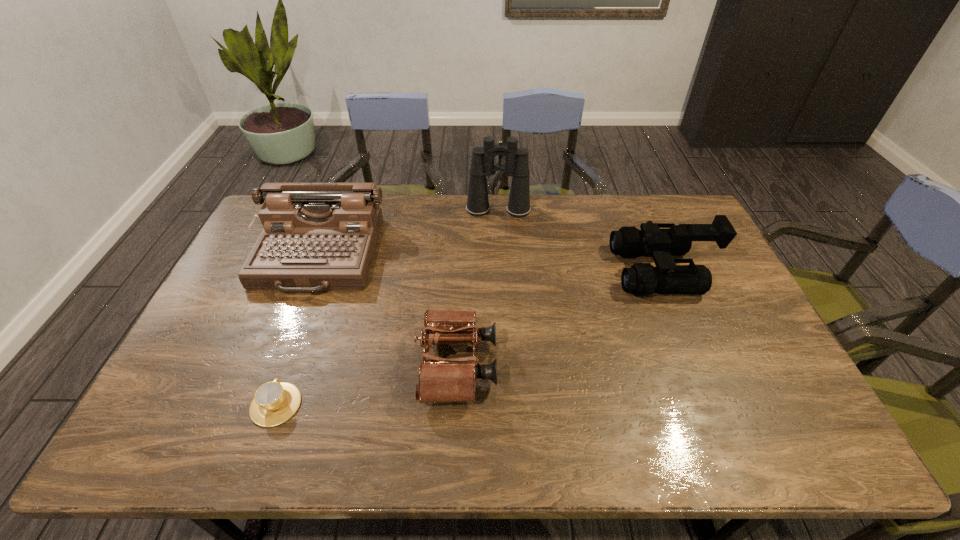
I want to click on binoculars that stands as the second closest to the farthest binoculars, so click(440, 380).

Identify the location of binoculars that can be found as the second closest to the rightmost object. This screenshot has width=960, height=540. (440, 380).

Image resolution: width=960 pixels, height=540 pixels. I want to click on free point that satisfies the following two spatial constraints: 1. on the front side of the farthest binoculars; 2. through the eyepieces of the shortest binoculars, so click(506, 364).

Image resolution: width=960 pixels, height=540 pixels. I want to click on vacant space that satisfies the following two spatial constraints: 1. with the handle on the side of the shortest object; 2. on the right side of the farthest binoculars, so click(346, 210).